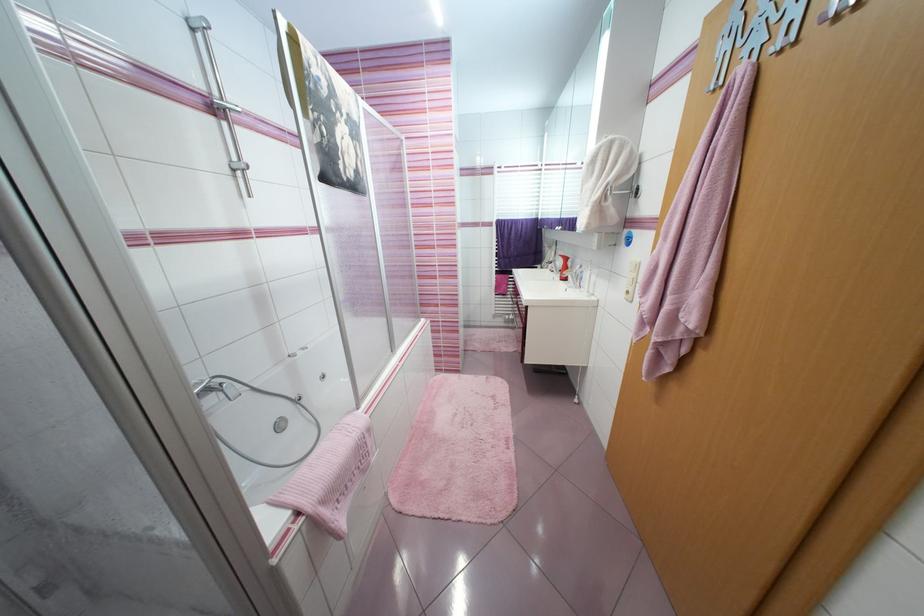
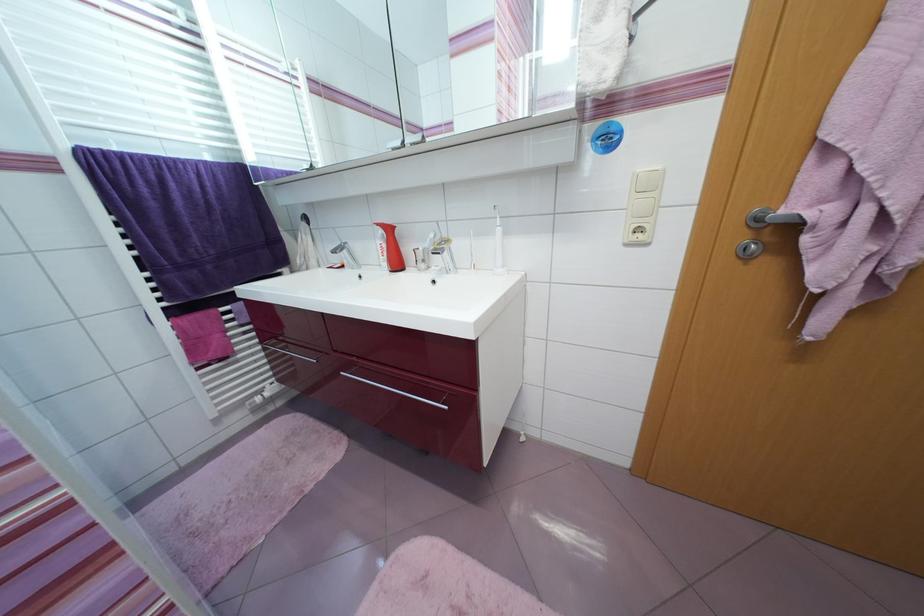
Where in the second image is the point corresponding to point (572, 261) from the first image?

(394, 231)